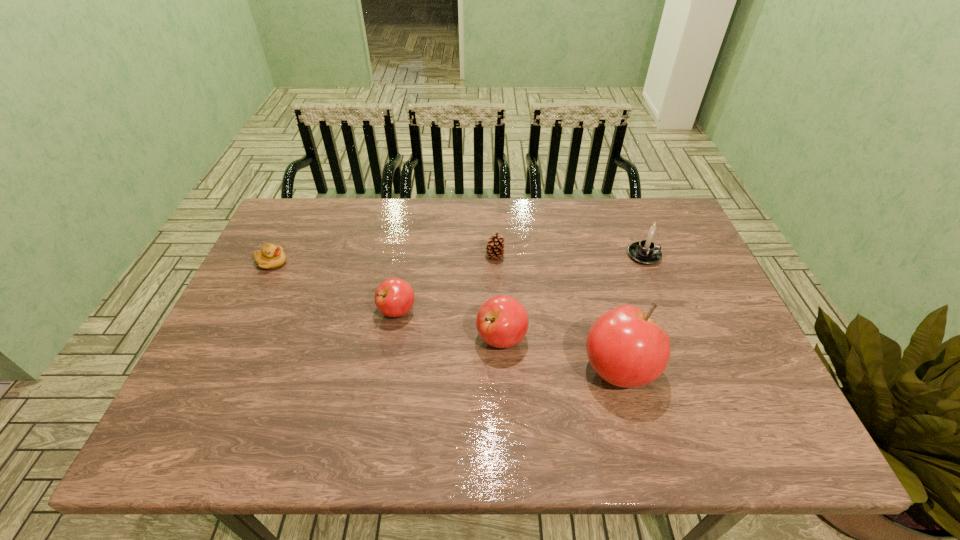
Identify the location of free point between the duckling and the pinecone. (383, 260).

Identify the location of free spot between the second shortest apple and the rightmost apple. (560, 354).

Locate an element on the screen. unoccupied position between the leftmost object and the shortest apple is located at coordinates (335, 287).

Locate which object ranks second in proximity to the second object from left to right. Please provide its 2D coordinates. Your answer should be formatted as a tuple, i.e. [(x, y)], where the tuple contains the x and y coordinates of a point satisfying the conditions above.

[(494, 248)]

Locate which object ranks fourth in proximity to the pinecone. Please provide its 2D coordinates. Your answer should be formatted as a tuple, i.e. [(x, y)], where the tuple contains the x and y coordinates of a point satisfying the conditions above.

[(646, 252)]

Select which apple is the closest to the rightmost apple. Please provide its 2D coordinates. Your answer should be formatted as a tuple, i.e. [(x, y)], where the tuple contains the x and y coordinates of a point satisfying the conditions above.

[(502, 321)]

This screenshot has height=540, width=960. Identify the location of apple that is the second closest to the pinecone. (394, 297).

Identify the location of free space that satisfies the following two spatial constraints: 1. on the front side of the second apple from left to right; 2. on the right side of the second object from left to right. The width and height of the screenshot is (960, 540). (393, 339).

You are a GUI agent. You are given a task and a screenshot of the screen. Output one action in this format:
    pyautogui.click(x=<x>, y=<y>)
    Task: Click on the free space that satisfies the following two spatial constraints: 1. on the front side of the leftmost apple; 2. on the right side of the rightmost apple
    
    Given the screenshot: What is the action you would take?
    pyautogui.click(x=387, y=369)

Find the location of `free space that satisfies the following two spatial constraints: 1. on the back side of the second shortest apple; 2. on the front-facing side of the leftmost object`. free space that satisfies the following two spatial constraints: 1. on the back side of the second shortest apple; 2. on the front-facing side of the leftmost object is located at coordinates (498, 263).